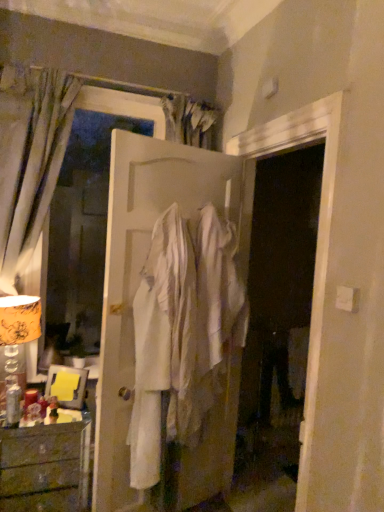
Question: Is the depth of wooden chest of drawers at lower left greater than that of white matte door at center?

Choices:
 (A) yes
 (B) no

Answer: (A)

Question: Can you confirm if wooden chest of drawers at lower left is positioned to the right of white matte door at center?

Choices:
 (A) yes
 (B) no

Answer: (B)

Question: Is wooden chest of drawers at lower left beside white matte door at center?

Choices:
 (A) no
 (B) yes

Answer: (A)

Question: Is wooden chest of drawers at lower left looking in the opposite direction of white matte door at center?

Choices:
 (A) yes
 (B) no

Answer: (B)

Question: Is wooden chest of drawers at lower left wider than white matte door at center?

Choices:
 (A) no
 (B) yes

Answer: (B)

Question: Is wooden chest of drawers at lower left closer to the viewer compared to white matte door at center?

Choices:
 (A) no
 (B) yes

Answer: (A)

Question: Could you tell me if white matte door at center is turned towards silky gray curtain at left?

Choices:
 (A) no
 (B) yes

Answer: (A)

Question: From the image's perspective, is white matte door at center below silky gray curtain at left?

Choices:
 (A) yes
 (B) no

Answer: (A)

Question: Does white matte door at center have a smaller size compared to silky gray curtain at left?

Choices:
 (A) no
 (B) yes

Answer: (A)

Question: Does white matte door at center have a larger size compared to silky gray curtain at left?

Choices:
 (A) no
 (B) yes

Answer: (B)

Question: Is white matte door at center closer to the viewer compared to silky gray curtain at left?

Choices:
 (A) yes
 (B) no

Answer: (A)

Question: Considering the relative positions of white matte door at center and silky gray curtain at left in the image provided, is white matte door at center behind silky gray curtain at left?

Choices:
 (A) yes
 (B) no

Answer: (B)

Question: Is silky gray curtain at left to the left of gold-patterned fabric lampshade at left from the viewer's perspective?

Choices:
 (A) yes
 (B) no

Answer: (B)